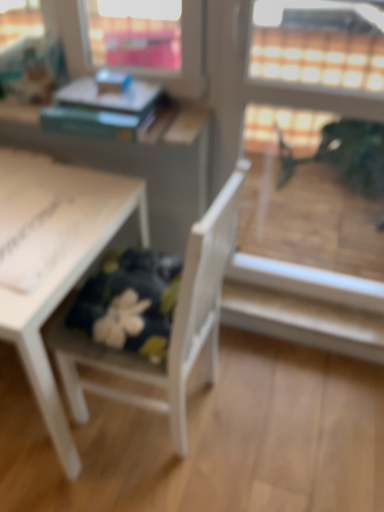
The height and width of the screenshot is (512, 384). What are the coordinates of `vacant point above white matte table at lower left (from a real-world perspective)` in the screenshot? It's located at (45, 202).